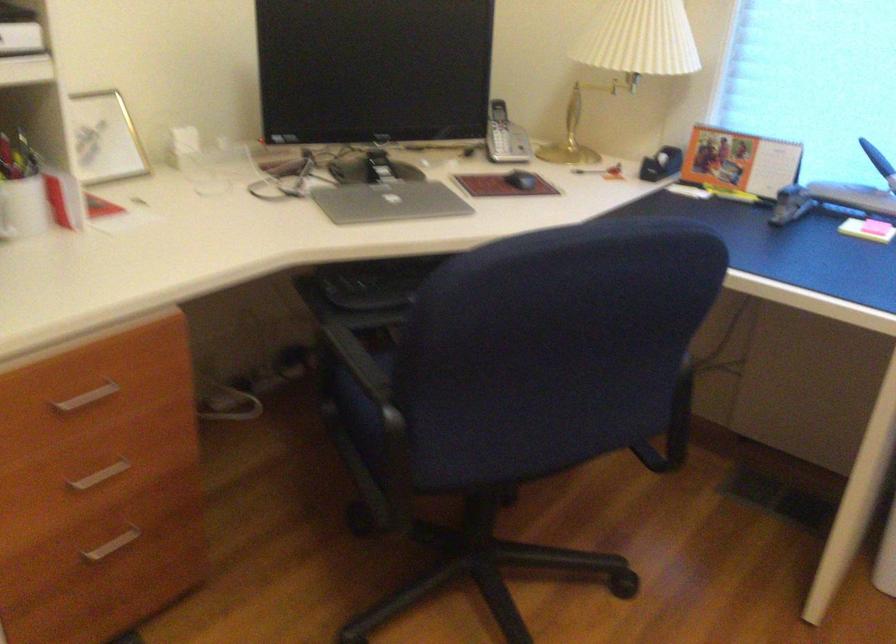
Find where to lift the white pen cup. Please return your answer as a coordinate pair (x, y).

(23, 207)